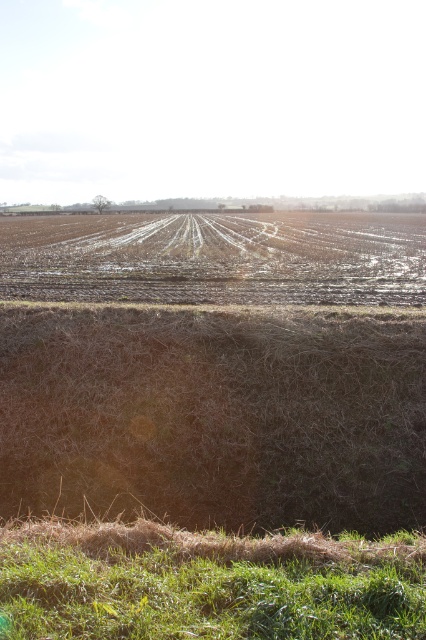
You are a farmer planning to plant crops in the area between the brown dry hay at lower center and the green grassy hill at lower center. Which object takes up more horizontal space in this area?

The brown dry hay at lower center takes up more horizontal space than the green grassy hill at lower center because its width is larger.

You are standing in a rural area and see the brown dry hay at lower center. If you want to reach it, how many steps would you need to take if each step covers 0.5 meters?

The brown dry hay at lower center is 5.08 meters away from viewer. Since each step covers 0.5 meters, you would need approximately 10 steps to reach it.

You are standing at the origin point in the rural landscape. There are two points marked in the image. Which point is closer to you, point (137, 397) or point (393, 545)?

Point (393, 545) is closer to you because it is in front of point (137, 397).